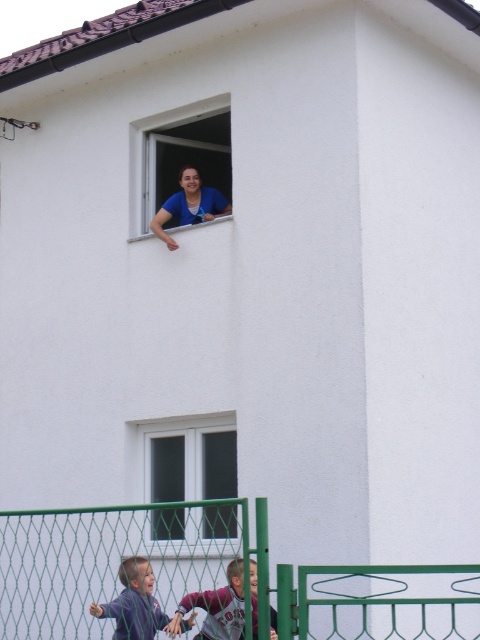
Question: Which point appears closest to the camera in this image?

Choices:
 (A) 159,182
 (B) 194,435
 (C) 347,620

Answer: (C)

Question: Can you confirm if transparent glass window at upper center is positioned above light brown hair at lower left?

Choices:
 (A) no
 (B) yes

Answer: (B)

Question: Based on their relative distances, which object is nearer to the green wire mesh gate at lower center?

Choices:
 (A) blue fabric at upper center
 (B) maroon jersey at lower center
 (C) transparent glass window at upper center
 (D) light brown hair at lower left

Answer: (B)

Question: Can you confirm if light brown hair at lower left is positioned to the right of blue fabric at upper center?

Choices:
 (A) yes
 (B) no

Answer: (B)

Question: Which point is farther to the camera?

Choices:
 (A) maroon jersey at lower center
 (B) green wire mesh gate at lower center
 (C) white plastic window at lower center

Answer: (C)

Question: Does transparent glass window at upper center have a smaller size compared to light brown hair at lower left?

Choices:
 (A) no
 (B) yes

Answer: (A)